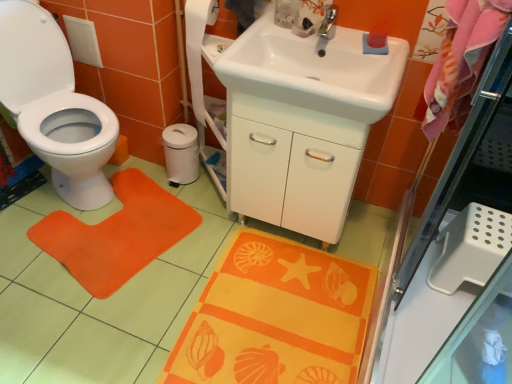
Question: Choose the correct answer: Is orange fabric doormat at left inside white glossy sink at upper center, the 1th sink when ordered from front to back, or outside it?

Choices:
 (A) inside
 (B) outside

Answer: (B)

Question: From the image's perspective, is orange fabric doormat at left positioned above or below white glossy sink at upper center, marked as the 2th sink in a back-to-front arrangement?

Choices:
 (A) below
 (B) above

Answer: (A)

Question: Considering the real-world distances, which object is farthest from the white matte toilet paper at center?

Choices:
 (A) white glossy sink at upper center, marked as the 2th sink in a back-to-front arrangement
 (B) pink fabric beach towel at upper right
 (C) transparent glass screen door at upper right
 (D) white glossy toilet at left
 (E) white glossy sink at center, the first sink viewed from the back

Answer: (B)

Question: Which is nearer to the white glossy sink at center, the first sink viewed from the back?

Choices:
 (A) white glossy toilet at left
 (B) orange fabric doormat at left
 (C) orange fabric bath mat at lower center
 (D) pink fabric beach towel at upper right
 (E) transparent glass screen door at upper right

Answer: (D)